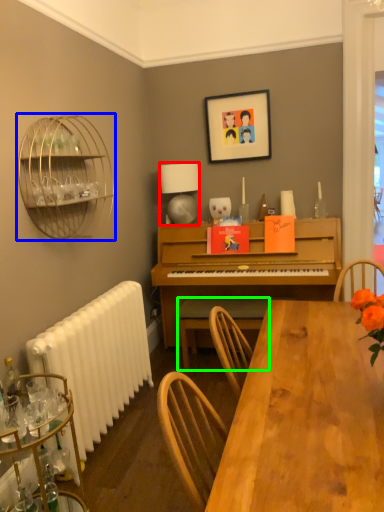
Question: Considering the real-world distances, which object is farthest from lamp (highlighted by a red box)? bird cage (highlighted by a blue box) or chair (highlighted by a green box)?

Choices:
 (A) bird cage
 (B) chair

Answer: (A)